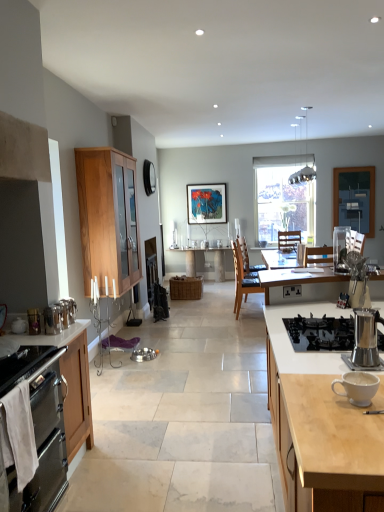
Identify the location of spots to the right of stainless steel oven at lower left, which is the second cabinetry in front-to-back order. The width and height of the screenshot is (384, 512). (118, 468).